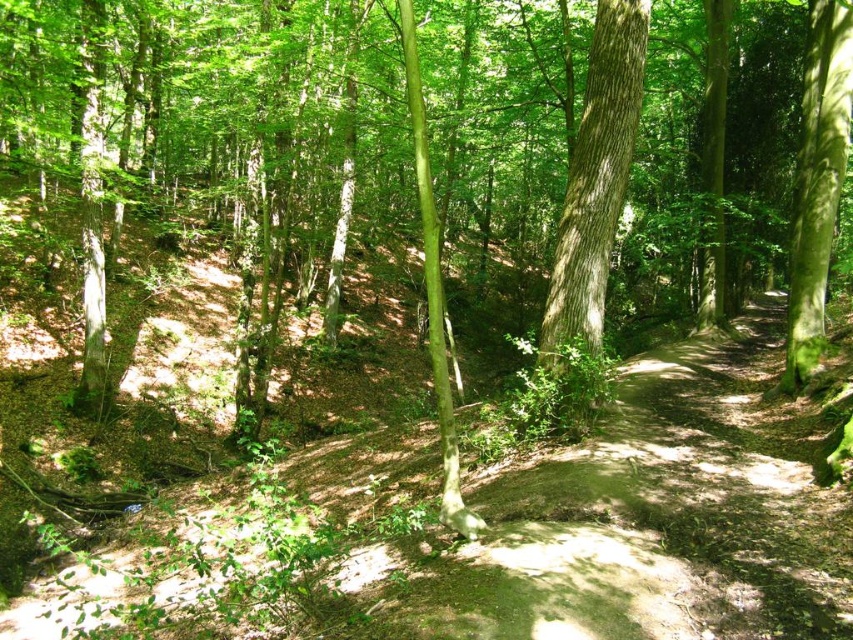
You are a hiker standing on the forest path and see the smooth bark tree at center and the green mossy tree at right. Which tree is closer to the ground?

The smooth bark tree at center is closer to the ground because it is located below the green mossy tree at right.

You are walking along a forest path and notice two points marked on the ground. The first is at point (637,67) and the second at point (807,106). If you are facing the direction of the path, which point would be closer to you?

Point (637,67) is in front of point (807,106), so the first point would be closer to you.

You are a hiker walking along the forest path and want to reach the green mossy tree at right. Which direction should you move relative to the smooth bark tree at center?

You should move towards the green mossy tree at right, which is located to the right of the smooth bark tree at center. Since the smooth bark tree at center is closer to you, you can walk around it and head towards the right side of the path to reach the green mossy tree at right.